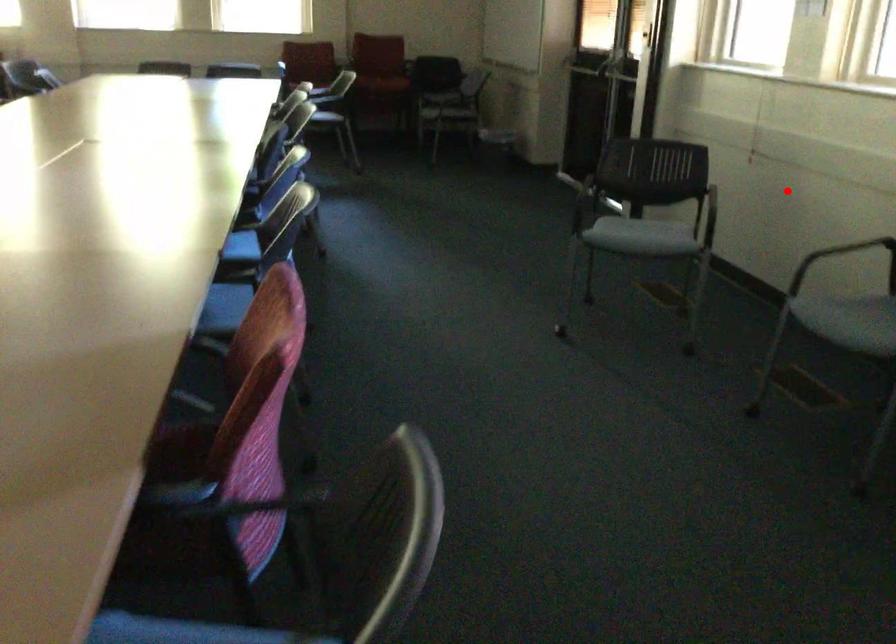
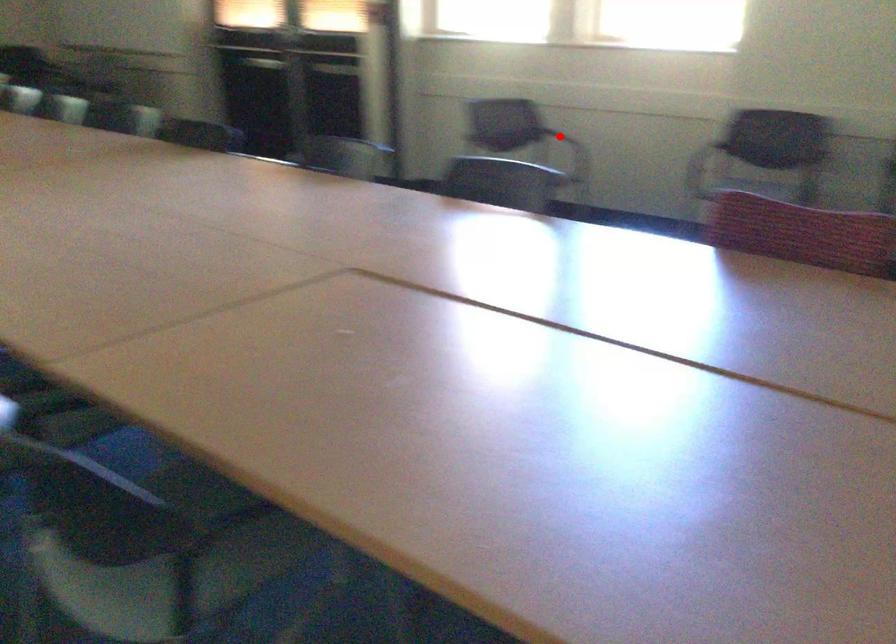
I am providing you with two images of the same scene from different viewpoints. A red point is marked on the first image and another point is marked on the second image. Is the marked point in image1 the same physical position as the marked point in image2?

Yes